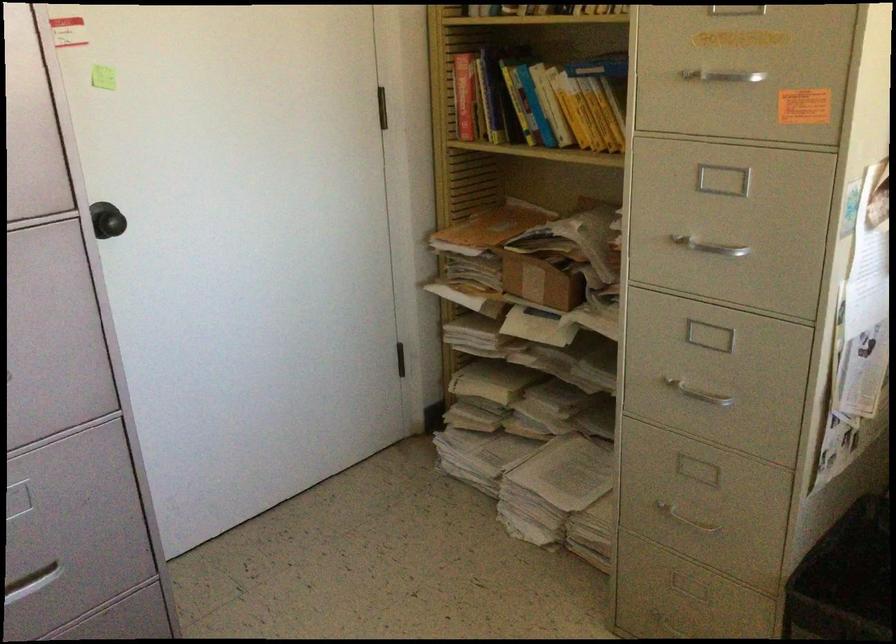
This screenshot has height=644, width=896. What are the coordinates of `yellow book` in the screenshot? It's located at (590, 114).